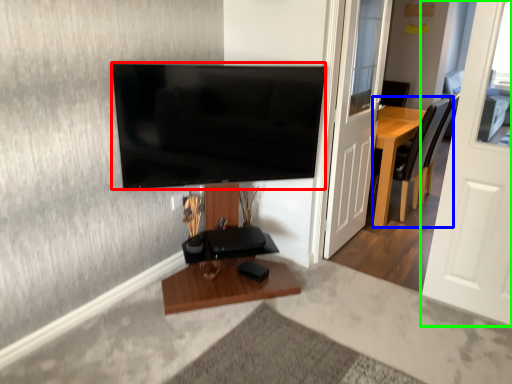
Question: Which object is positioned closest to television (highlighted by a red box)? Select from chair (highlighted by a blue box) and door (highlighted by a green box).

Choices:
 (A) chair
 (B) door

Answer: (B)